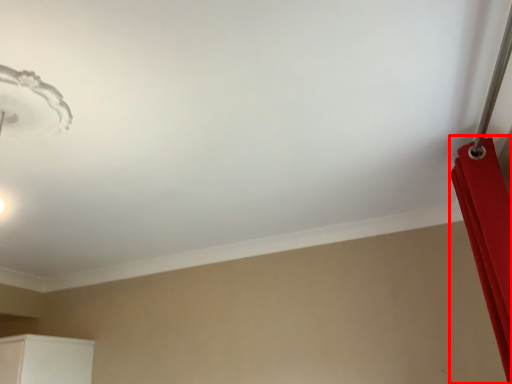
Question: From the image's perspective, what is the correct spatial relationship of curtain (annotated by the red box) in relation to lamp?

Choices:
 (A) above
 (B) below

Answer: (B)